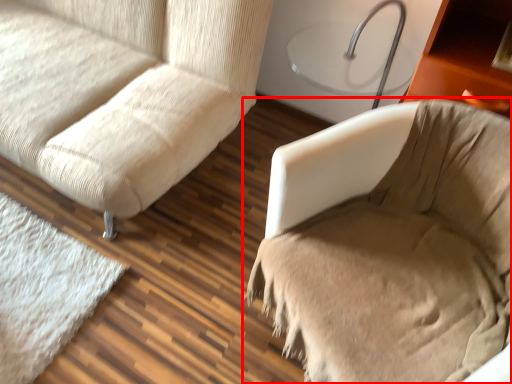
Question: From the image's perspective, what is the correct spatial positioning of furniture (annotated by the red box) in reference to studio couch?

Choices:
 (A) below
 (B) above

Answer: (A)